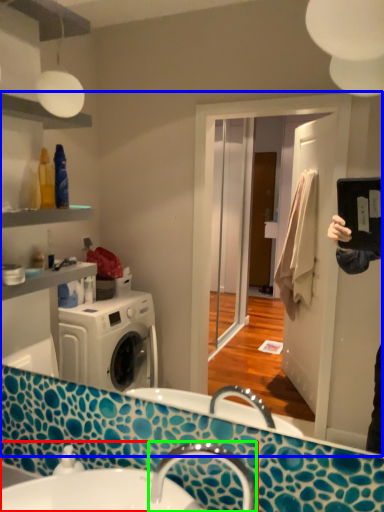
Question: Which is farther away from sink (highlighted by a red box)? mirror (highlighted by a blue box) or tap (highlighted by a green box)?

Choices:
 (A) mirror
 (B) tap

Answer: (A)